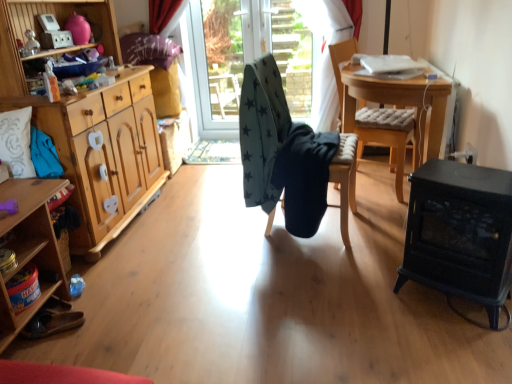
Question: From the image's perspective, is brown leather shoes at lower left located above or below dark blue fabric at center, the second chair in the left-to-right sequence?

Choices:
 (A) above
 (B) below

Answer: (B)

Question: Is brown leather shoes at lower left inside the boundaries of dark blue fabric at center, positioned as the 2th chair in right-to-left order, or outside?

Choices:
 (A) outside
 (B) inside

Answer: (A)

Question: Estimate the real-world distances between objects in this image. Which object is farther from the white embroidered pillow at left?

Choices:
 (A) wooden cabinet at left
 (B) wooden cabinet at left
 (C) teal star-patterned fabric at center, placed as the third chair when sorted from right to left
 (D) wooden cushioned chair at center, the 1th chair from the right
 (E) wooden table at center

Answer: (D)

Question: Estimate the real-world distances between objects in this image. Which object is closer to the wooden cushioned chair at center, acting as the 3th chair starting from the left?

Choices:
 (A) brown leather shoes at lower left
 (B) dark blue fabric at center, positioned as the 2th chair in right-to-left order
 (C) dark gray fabric at center
 (D) teal star-patterned fabric at center, which ranks as the first chair in left-to-right order
 (E) wooden cabinet at left

Answer: (D)